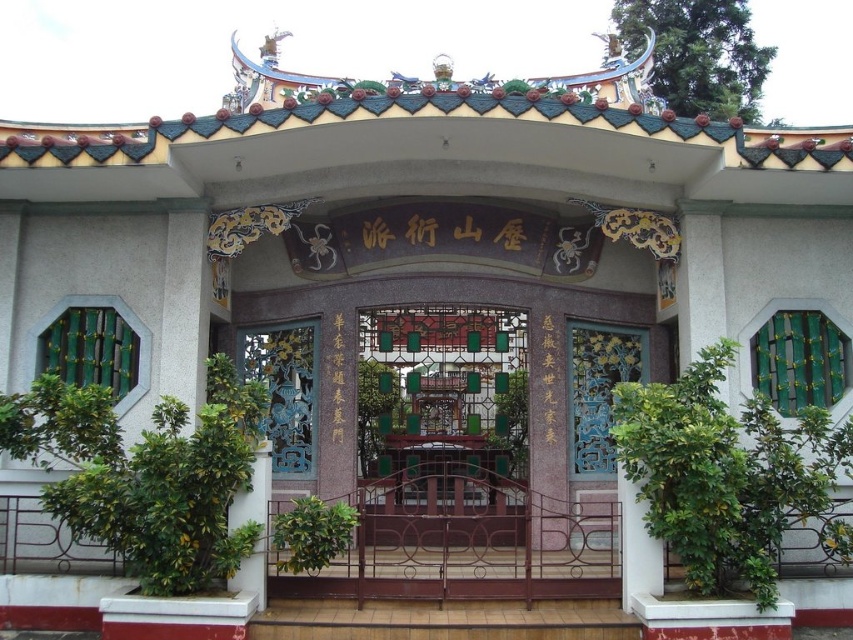
You are standing at the entrance of the traditional building and want to take a photo. There are two points marked in the scene. One is at coordinate point (572, 324) and the other is at point (254, 552). Which point is closer to your camera lens?

Point (254, 552) is closer to the camera lens because it is less further away compared to point (572, 324), which is further to the camera.